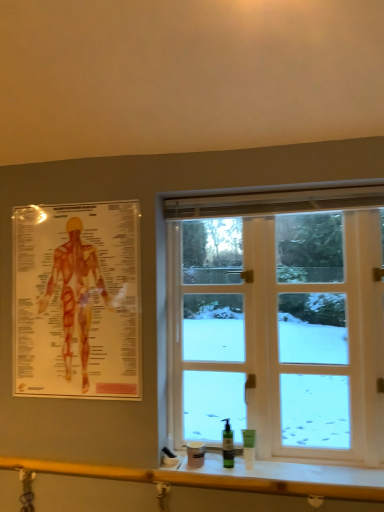
Question: Should I look upward or downward to see white glass window at center?

Choices:
 (A) up
 (B) down

Answer: (B)

Question: Considering the relative sizes of green matte pump bottle at lower center, arranged as the first toiletry when viewed from the left, and green plastic bottle at lower right, which is counted as the 2th toiletry, starting from the left, in the image provided, is green matte pump bottle at lower center, arranged as the first toiletry when viewed from the left, shorter than green plastic bottle at lower right, which is counted as the 2th toiletry, starting from the left,?

Choices:
 (A) yes
 (B) no

Answer: (B)

Question: Considering the relative positions of green matte pump bottle at lower center, the 2th toiletry when ordered from right to left, and green plastic bottle at lower right, which appears as the 1th toiletry when viewed from the right, in the image provided, is green matte pump bottle at lower center, the 2th toiletry when ordered from right to left, behind green plastic bottle at lower right, which appears as the 1th toiletry when viewed from the right,?

Choices:
 (A) yes
 (B) no

Answer: (A)

Question: Would you consider green matte pump bottle at lower center, arranged as the first toiletry when viewed from the left, to be distant from green plastic bottle at lower right, which appears as the 1th toiletry when viewed from the right?

Choices:
 (A) no
 (B) yes

Answer: (A)

Question: From the image's perspective, is green matte pump bottle at lower center, the 2th toiletry when ordered from right to left, located above green plastic bottle at lower right, which appears as the 1th toiletry when viewed from the right?

Choices:
 (A) yes
 (B) no

Answer: (A)

Question: From a real-world perspective, is green matte pump bottle at lower center, arranged as the first toiletry when viewed from the left, on green plastic bottle at lower right, which appears as the 1th toiletry when viewed from the right?

Choices:
 (A) no
 (B) yes

Answer: (B)

Question: Is green matte pump bottle at lower center, arranged as the first toiletry when viewed from the left, located outside green plastic bottle at lower right, which appears as the 1th toiletry when viewed from the right?

Choices:
 (A) yes
 (B) no

Answer: (A)

Question: Considering the relative positions of green matte pump bottle at lower center, arranged as the first toiletry when viewed from the left, and wooden at lower center in the image provided, is green matte pump bottle at lower center, arranged as the first toiletry when viewed from the left, to the left of wooden at lower center from the viewer's perspective?

Choices:
 (A) yes
 (B) no

Answer: (B)

Question: Could you tell me if green matte pump bottle at lower center, arranged as the first toiletry when viewed from the left, is facing wooden at lower center?

Choices:
 (A) no
 (B) yes

Answer: (A)

Question: Does green matte pump bottle at lower center, arranged as the first toiletry when viewed from the left, have a greater height compared to wooden at lower center?

Choices:
 (A) no
 (B) yes

Answer: (B)

Question: Is green matte pump bottle at lower center, the 2th toiletry when ordered from right to left, directly adjacent to wooden at lower center?

Choices:
 (A) yes
 (B) no

Answer: (B)

Question: Does green matte pump bottle at lower center, arranged as the first toiletry when viewed from the left, have a smaller size compared to wooden at lower center?

Choices:
 (A) yes
 (B) no

Answer: (A)

Question: Can we say green matte pump bottle at lower center, the 2th toiletry when ordered from right to left, lies outside wooden at lower center?

Choices:
 (A) yes
 (B) no

Answer: (A)

Question: Considering the relative sizes of wooden at lower center and white glass window at center in the image provided, is wooden at lower center taller than white glass window at center?

Choices:
 (A) no
 (B) yes

Answer: (A)